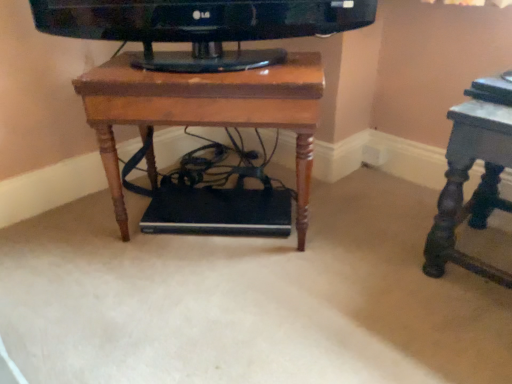
Where is `vacant region above wooden table at center, arranged as the 2th table when viewed from the right (from a real-world perspective)`? vacant region above wooden table at center, arranged as the 2th table when viewed from the right (from a real-world perspective) is located at coordinates (219, 62).